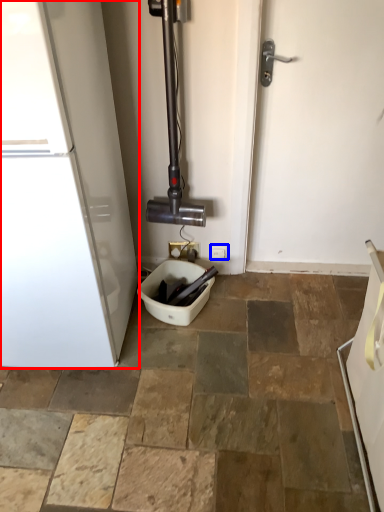
Question: Among these objects, which one is farthest to the camera, home appliance (highlighted by a red box) or electric outlet (highlighted by a blue box)?

Choices:
 (A) home appliance
 (B) electric outlet

Answer: (B)